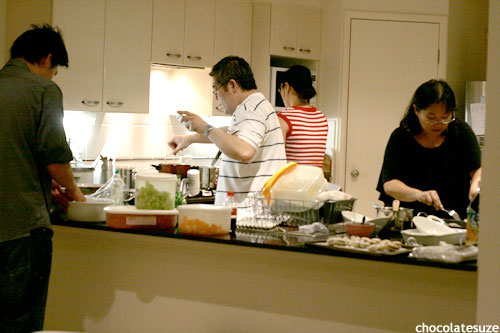
This screenshot has height=333, width=500. In order to click on washed dishes in this screenshot , I will do `click(284, 189)`.